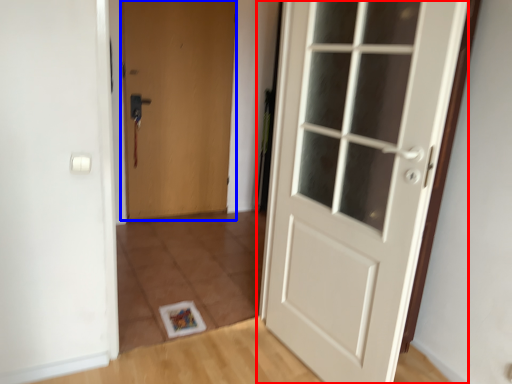
Question: Among these objects, which one is nearest to the camera, door (highlighted by a red box) or door (highlighted by a blue box)?

Choices:
 (A) door
 (B) door

Answer: (A)